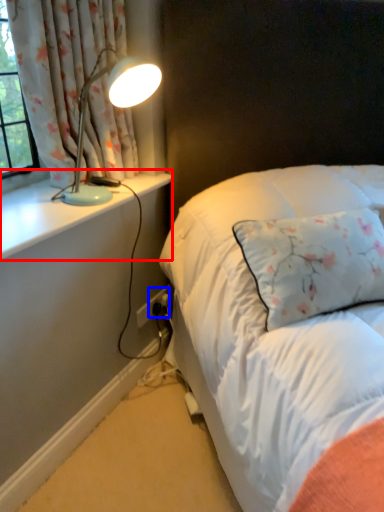
Question: Which of the following is the farthest to the observer, window sill (highlighted by a red box) or electric outlet (highlighted by a blue box)?

Choices:
 (A) window sill
 (B) electric outlet

Answer: (B)